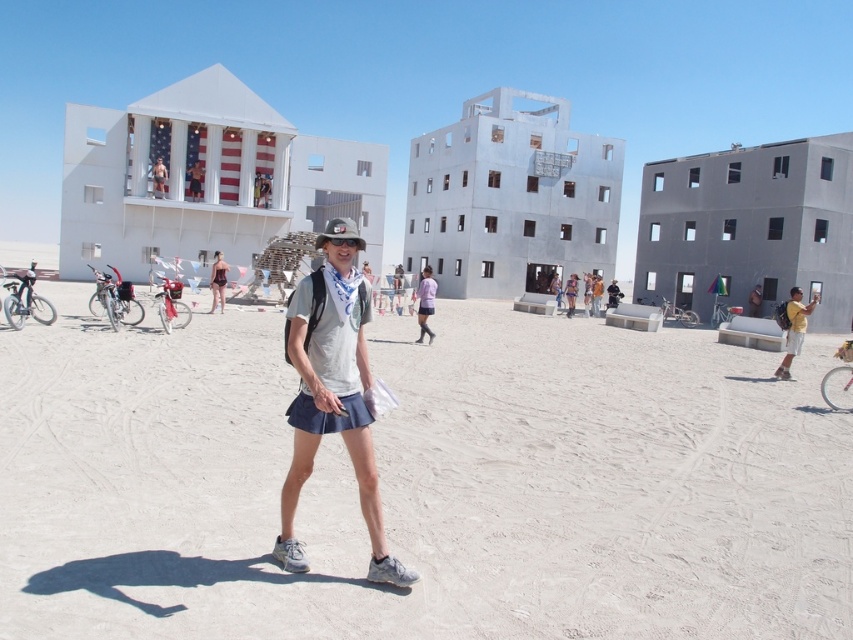
Is white sand at center to the right of metallic silver figure at upper center from the viewer's perspective?

Indeed, white sand at center is positioned on the right side of metallic silver figure at upper center.

Between white sand at center and metallic silver figure at upper center, which one appears on the left side from the viewer's perspective?

metallic silver figure at upper center is more to the left.

Is point (598, 628) farther from viewer compared to point (161, 173)?

That is False.

Identify the location of white sand at center. The height and width of the screenshot is (640, 853). (422, 484).

Who is positioned more to the right, black fabric hat at center or metallic silver figure at upper center?

From the viewer's perspective, black fabric hat at center appears more on the right side.

Who is more forward, (320, 244) or (164, 166)?

Point (320, 244)

Image resolution: width=853 pixels, height=640 pixels. What are the coordinates of `black fabric hat at center` in the screenshot? It's located at (340, 232).

Does gray fabric skirt at center appear under black fabric hat at center?

Indeed, gray fabric skirt at center is positioned under black fabric hat at center.

Can you confirm if gray fabric skirt at center is positioned to the left of black fabric hat at center?

Incorrect, gray fabric skirt at center is not on the left side of black fabric hat at center.

What do you see at coordinates (332, 400) in the screenshot? This screenshot has height=640, width=853. I see `gray fabric skirt at center` at bounding box center [332, 400].

Where is `gray fabric skirt at center`? The width and height of the screenshot is (853, 640). gray fabric skirt at center is located at coordinates (332, 400).